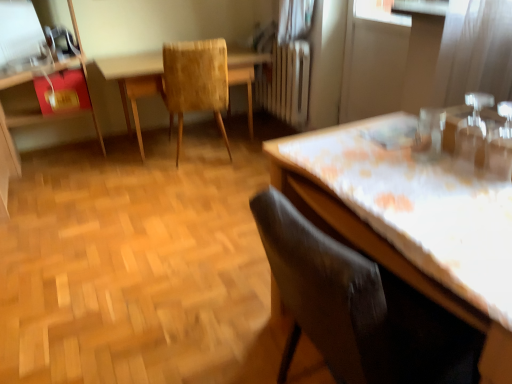
At what (x,y) coordinates should I click in order to perform the action: click on free area in between velvet dark brown chair at lower right, arranged as the 2th chair when viewed from the top, and matte red dresser at left. Please return your answer as a coordinate pair (x, y). Image resolution: width=512 pixels, height=384 pixels. Looking at the image, I should click on (153, 252).